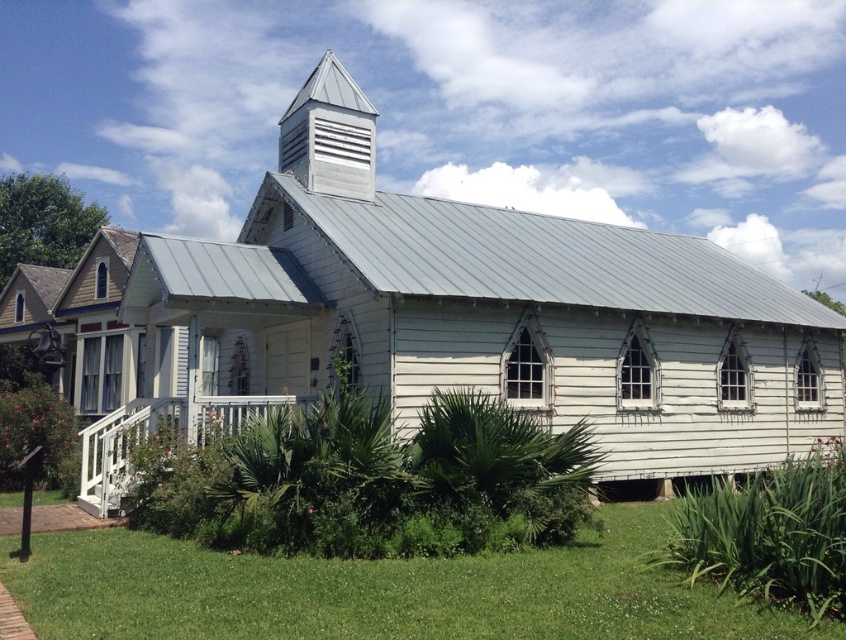
You are standing at the entrance of the building and want to walk towards the green grass at lower center. According to the coordinates provided in the description, in which direction should you move relative to the building?

The green grass at lower center is located at point (377, 592), which means it is positioned to the right and slightly forward from the entrance. You should move towards the right side of the building to reach it.

You are standing in front of the building and want to know which structure is taller between the white painted wood porch at lower left and the metallic silver spire at upper center. Can you determine this based on their positions?

The white painted wood porch at lower left is not as tall as metallic silver spire at upper center, so the metallic silver spire at upper center is taller.